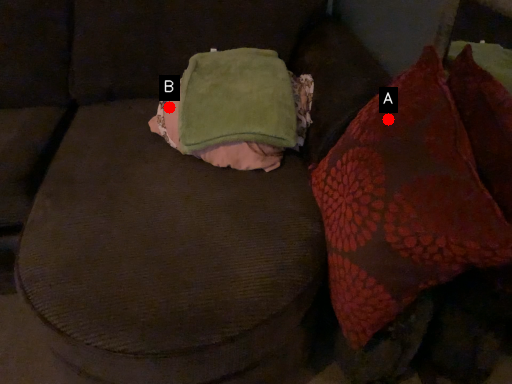
Question: Two points are circled on the image, labeled by A and B beside each circle. Among these points, which one is nearest to the camera?

Choices:
 (A) A is closer
 (B) B is closer

Answer: (A)